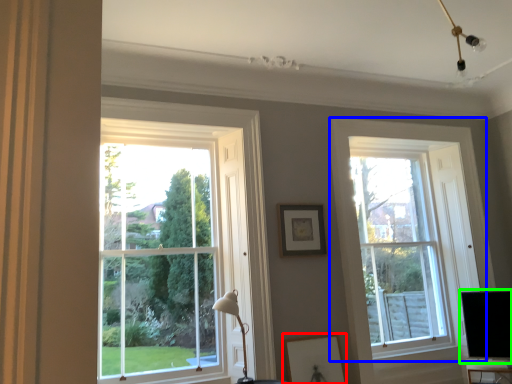
Question: Which object is the farthest from picture frame (highlighted by a red box)? Choose among these: window (highlighted by a blue box) or computer monitor (highlighted by a green box).

Choices:
 (A) window
 (B) computer monitor

Answer: (B)